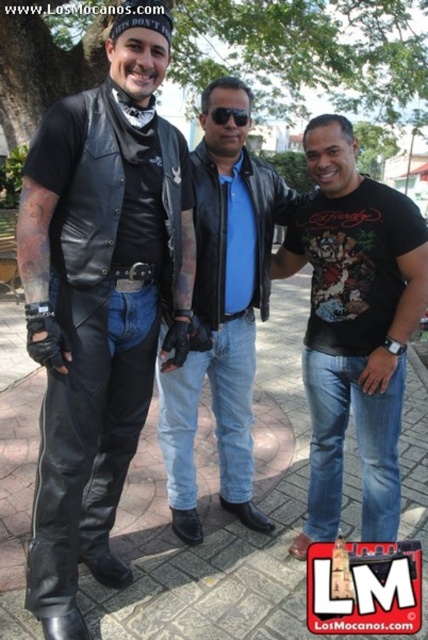
Between black leather jacket at center and black plastic sunglasses at center, which one is positioned lower?

black leather jacket at center is lower down.

This screenshot has width=428, height=640. Describe the element at coordinates (222, 314) in the screenshot. I see `black leather jacket at center` at that location.

Where is `black leather jacket at center`? Image resolution: width=428 pixels, height=640 pixels. black leather jacket at center is located at coordinates (222, 314).

This screenshot has width=428, height=640. I want to click on black leather jacket at center, so click(x=222, y=314).

Does black cotton t-shirt at center have a larger size compared to black leather jacket at center?

Indeed, black cotton t-shirt at center has a larger size compared to black leather jacket at center.

Between point (347, 275) and point (220, 216), which one is positioned behind?

Point (220, 216)

Locate an element on the screen. The width and height of the screenshot is (428, 640). black cotton t-shirt at center is located at coordinates (353, 326).

Does point (26, 252) lie in front of point (243, 115)?

Yes, it is in front of point (243, 115).

Does point (95, 177) come farther from viewer compared to point (232, 113)?

No, (95, 177) is in front of (232, 113).

Locate an element on the screen. This screenshot has width=428, height=640. matte black leather pants at center is located at coordinates (101, 300).